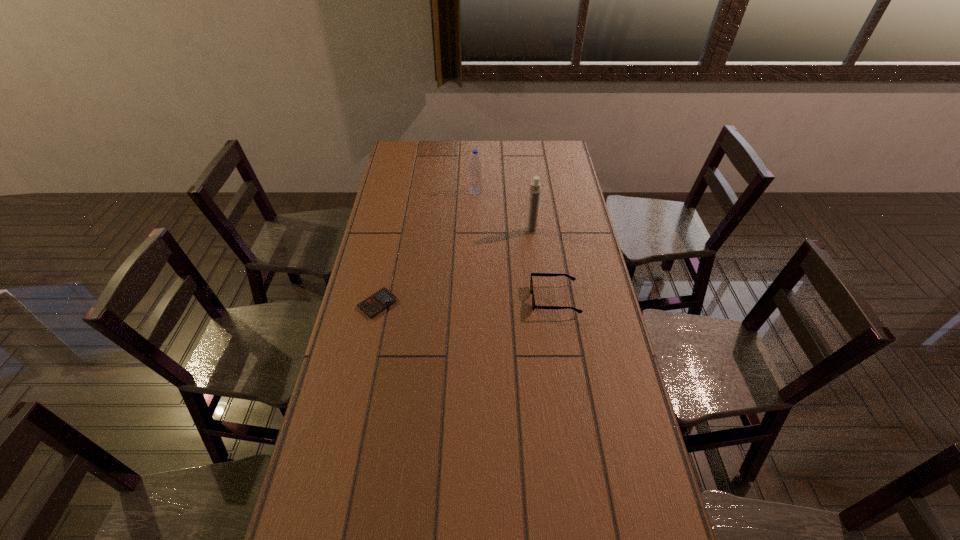
Identify which object is the closest to the spectacles. Please provide its 2D coordinates. Your answer should be formatted as a tuple, i.e. [(x, y)], where the tuple contains the x and y coordinates of a point satisfying the conditions above.

[(534, 194)]

Identify which object is located as the second nearest to the spectacles. Please provide its 2D coordinates. Your answer should be formatted as a tuple, i.e. [(x, y)], where the tuple contains the x and y coordinates of a point satisfying the conditions above.

[(382, 299)]

Locate an element on the screen. The image size is (960, 540). free space that satisfies the following two spatial constraints: 1. on the front side of the farthest object; 2. on the right side of the third nearest object is located at coordinates (475, 230).

This screenshot has height=540, width=960. In order to click on blank space that satisfies the following two spatial constraints: 1. on the front side of the second tallest object; 2. on the left side of the aerosol can in this screenshot , I will do `click(475, 230)`.

The image size is (960, 540). I want to click on vacant position in the image that satisfies the following two spatial constraints: 1. on the front side of the third object from right to left; 2. on the left side of the tallest object, so [475, 230].

Find the location of a particular element. free space in the image that satisfies the following two spatial constraints: 1. on the back side of the shortest object; 2. on the left side of the farthest object is located at coordinates (401, 191).